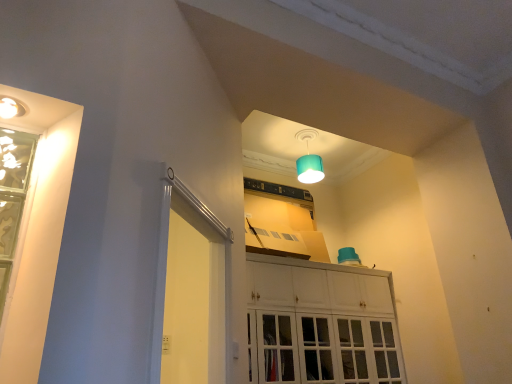
Question: Can you confirm if green glass window at left is taller than teal fabric lampshade at upper center?

Choices:
 (A) yes
 (B) no

Answer: (A)

Question: Can teal fabric lampshade at upper center be found inside green glass window at left?

Choices:
 (A) yes
 (B) no

Answer: (B)

Question: Is green glass window at left wider than teal fabric lampshade at upper center?

Choices:
 (A) yes
 (B) no

Answer: (B)

Question: Considering the relative sizes of green glass window at left and teal fabric lampshade at upper center in the image provided, is green glass window at left thinner than teal fabric lampshade at upper center?

Choices:
 (A) no
 (B) yes

Answer: (B)

Question: Are green glass window at left and teal fabric lampshade at upper center making contact?

Choices:
 (A) yes
 (B) no

Answer: (B)

Question: From a real-world perspective, does green glass window at left sit lower than teal fabric lampshade at upper center?

Choices:
 (A) no
 (B) yes

Answer: (B)

Question: Does white glossy cabinet at center have a smaller size compared to teal fabric lampshade at upper center?

Choices:
 (A) no
 (B) yes

Answer: (A)

Question: Considering the relative sizes of white glossy cabinet at center and teal fabric lampshade at upper center in the image provided, is white glossy cabinet at center bigger than teal fabric lampshade at upper center?

Choices:
 (A) no
 (B) yes

Answer: (B)

Question: Is white glossy cabinet at center looking in the opposite direction of teal fabric lampshade at upper center?

Choices:
 (A) no
 (B) yes

Answer: (A)

Question: Can you confirm if white glossy cabinet at center is positioned to the left of teal fabric lampshade at upper center?

Choices:
 (A) no
 (B) yes

Answer: (B)

Question: Could you tell me if white glossy cabinet at center is turned towards teal fabric lampshade at upper center?

Choices:
 (A) yes
 (B) no

Answer: (B)

Question: Is white glossy cabinet at center further to camera compared to teal fabric lampshade at upper center?

Choices:
 (A) no
 (B) yes

Answer: (A)

Question: Considering the relative positions of white glossy screen door at left and white glossy cabinet at center in the image provided, is white glossy screen door at left to the right of white glossy cabinet at center from the viewer's perspective?

Choices:
 (A) no
 (B) yes

Answer: (A)